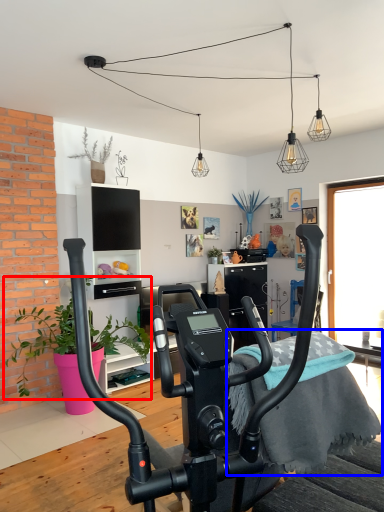
Question: Which point is closer to the camera, plant (highlighted by a red box) or bedding (highlighted by a blue box)?

Choices:
 (A) plant
 (B) bedding

Answer: (B)